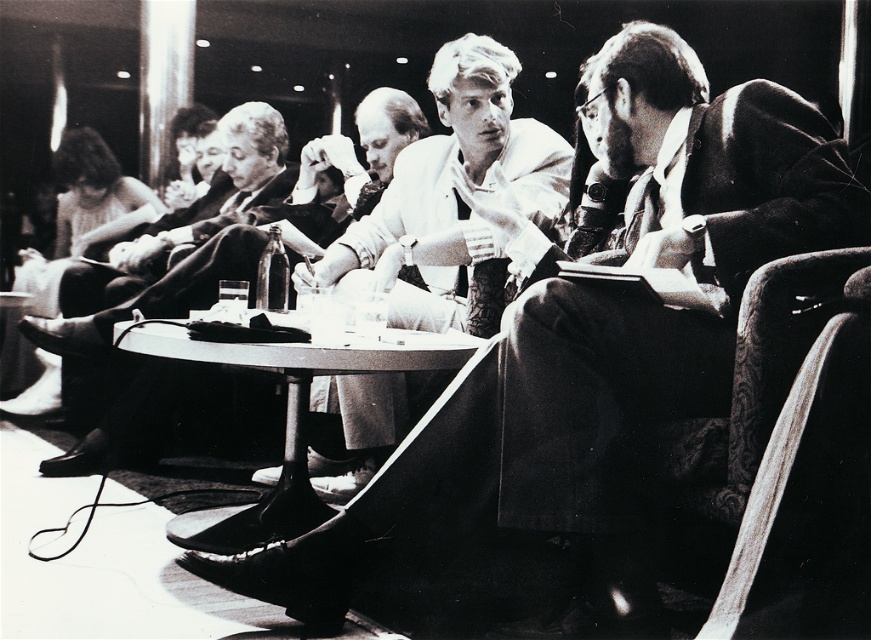
Who is more distant from viewer, (369,230) or (164,292)?

Point (164,292)

This screenshot has height=640, width=871. What do you see at coordinates (453, 200) in the screenshot?
I see `white cotton shirt at center` at bounding box center [453, 200].

At what (x,y) coordinates should I click in order to perform the action: click on white cotton shirt at center. Please return your answer as a coordinate pair (x, y). This screenshot has height=640, width=871. Looking at the image, I should click on (453, 200).

Looking at this image, who is more forward, (335, 464) or (311, 508)?

Point (311, 508)

Consider the image. Does white cotton shirt at center have a greater width compared to smooth plastic table at center?

Correct, the width of white cotton shirt at center exceeds that of smooth plastic table at center.

Does point (387, 266) come behind point (302, 404)?

Yes, it is behind point (302, 404).

Where is `white cotton shirt at center`? white cotton shirt at center is located at coordinates (453, 200).

Does smooth leather jacket at center have a greater height compared to smooth plastic table at center?

Yes, smooth leather jacket at center is taller than smooth plastic table at center.

Is smooth leather jacket at center to the left of smooth plastic table at center from the viewer's perspective?

Yes, smooth leather jacket at center is to the left of smooth plastic table at center.

Does point (376, 157) come in front of point (282, 534)?

That is False.

Where is `smooth leather jacket at center`? smooth leather jacket at center is located at coordinates (354, 160).